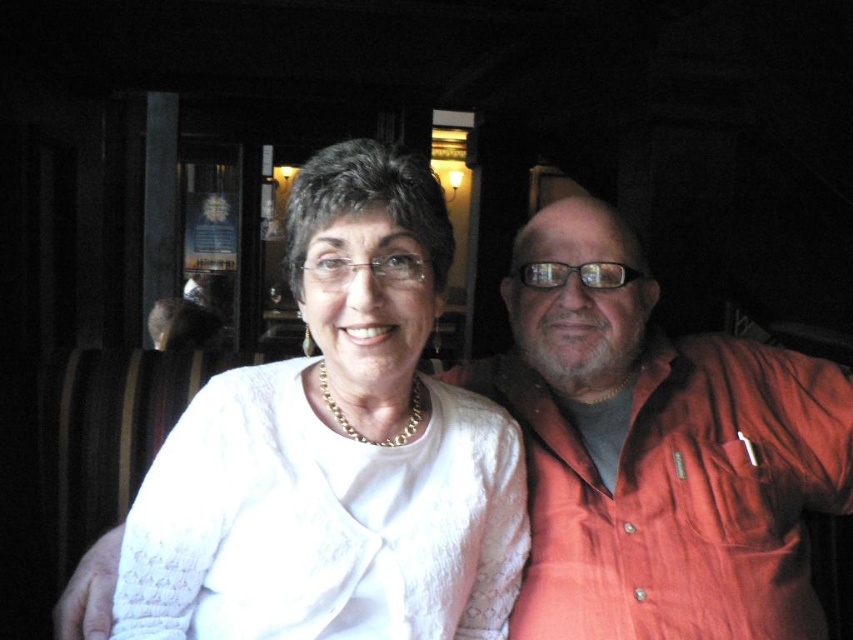
Question: Which point appears closest to the camera in this image?

Choices:
 (A) (305, 166)
 (B) (677, 584)

Answer: (A)

Question: Is white textured blouse at center smaller than matte orange shirt at center?

Choices:
 (A) yes
 (B) no

Answer: (A)

Question: Does white textured blouse at center appear on the right side of matte orange shirt at center?

Choices:
 (A) yes
 (B) no

Answer: (B)

Question: Does white textured blouse at center appear on the right side of matte orange shirt at center?

Choices:
 (A) yes
 (B) no

Answer: (B)

Question: Which point is closer to the camera taking this photo?

Choices:
 (A) (558, 490)
 (B) (415, 572)

Answer: (B)

Question: Which object appears farthest from the camera in this image?

Choices:
 (A) matte orange shirt at center
 (B) white textured blouse at center

Answer: (A)